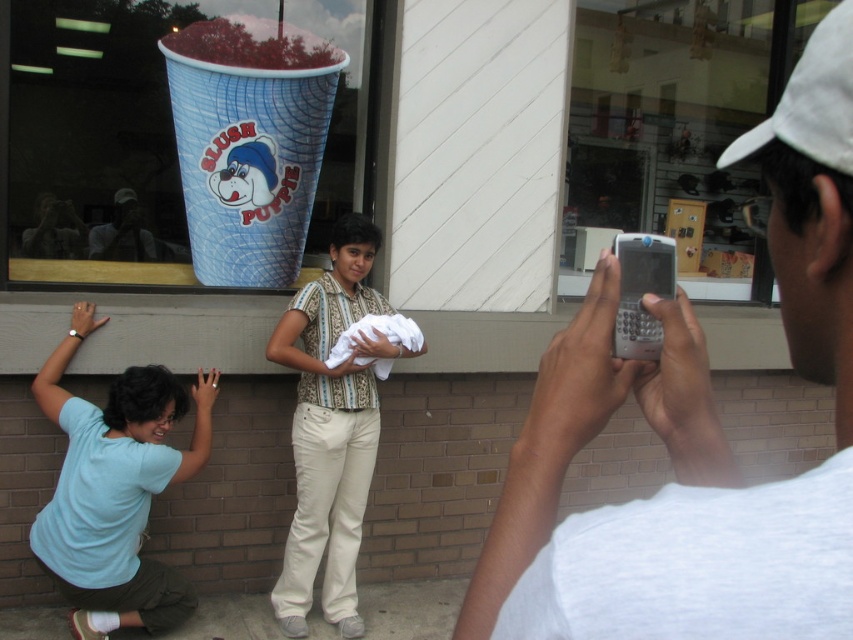
Does silver metallic phone at upper right appear on the left side of light blue t-shirt at lower left?

Incorrect, silver metallic phone at upper right is not on the left side of light blue t-shirt at lower left.

Image resolution: width=853 pixels, height=640 pixels. In order to click on silver metallic phone at upper right in this screenshot , I will do `click(695, 432)`.

Which of these two, silver metallic phone at upper right or striped cotton shirt at center, stands taller?

With more height is striped cotton shirt at center.

Describe the element at coordinates (695, 432) in the screenshot. Image resolution: width=853 pixels, height=640 pixels. I see `silver metallic phone at upper right` at that location.

Who is more distant from viewer, (x=833, y=250) or (x=364, y=300)?

Point (x=364, y=300)

Where is `silver metallic phone at upper right`? The height and width of the screenshot is (640, 853). silver metallic phone at upper right is located at coordinates 695,432.

Between light blue t-shirt at lower left and striped cotton shirt at center, which one appears on the left side from the viewer's perspective?

light blue t-shirt at lower left

Can you confirm if light blue t-shirt at lower left is bigger than striped cotton shirt at center?

No, light blue t-shirt at lower left is not bigger than striped cotton shirt at center.

Which is in front, point (177, 625) or point (289, 541)?

Point (177, 625)

Find the location of a particular element. This screenshot has width=853, height=640. light blue t-shirt at lower left is located at coordinates (115, 488).